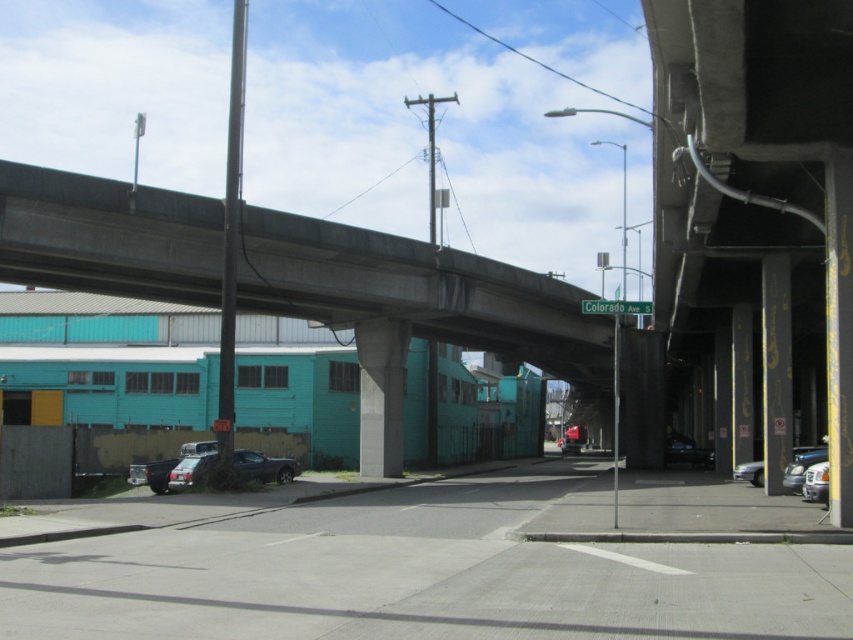
Is concrete bridge at upper center to the left of silver metallic car at lower right from the viewer's perspective?

Yes, concrete bridge at upper center is to the left of silver metallic car at lower right.

Is point (370, 298) less distant than point (793, 484)?

No, it is behind (793, 484).

I want to click on concrete bridge at upper center, so click(416, 291).

Which is above, concrete bridge at upper center or metallic silver car at center?

Positioned higher is concrete bridge at upper center.

This screenshot has height=640, width=853. What are the coordinates of `concrete bridge at upper center` in the screenshot? It's located at (416, 291).

Is concrete bridge at upper center to the left of silver metallic sedan at lower right from the viewer's perspective?

Indeed, concrete bridge at upper center is positioned on the left side of silver metallic sedan at lower right.

Looking at this image, who is more forward, (555, 308) or (808, 484)?

Point (808, 484)

Where is `concrete bridge at upper center`? The height and width of the screenshot is (640, 853). concrete bridge at upper center is located at coordinates (416, 291).